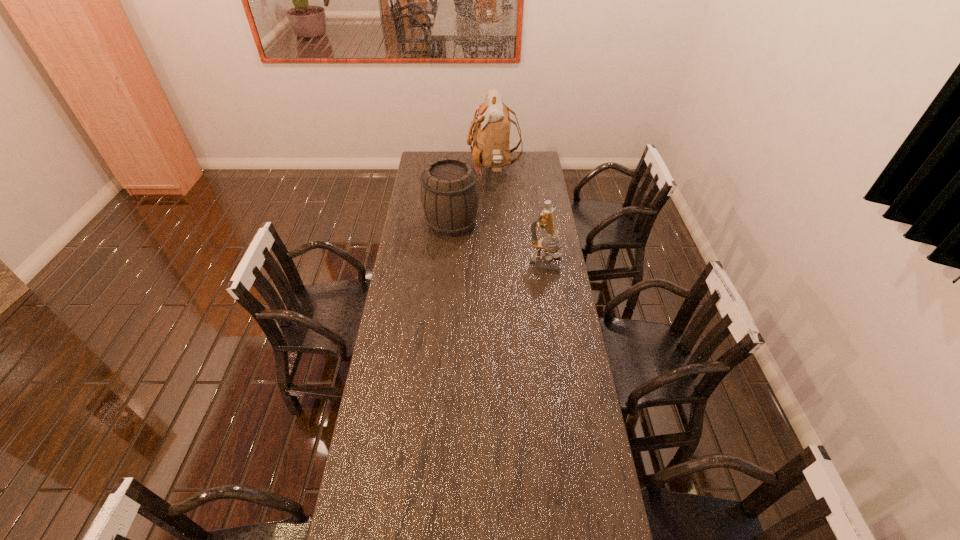
Where is `vacant area between the microscope and the second nearest object`? vacant area between the microscope and the second nearest object is located at coordinates (498, 244).

The image size is (960, 540). I want to click on vacant region between the microscope and the tallest object, so click(x=519, y=217).

Image resolution: width=960 pixels, height=540 pixels. I want to click on vacant point located between the nearest object and the wine bucket, so click(498, 244).

Select which object is the second closest to the second farthest object. Please provide its 2D coordinates. Your answer should be formatted as a tuple, i.e. [(x, y)], where the tuple contains the x and y coordinates of a point satisfying the conditions above.

[(546, 220)]

Choose which object is the second nearest neighbor to the wine bucket. Please provide its 2D coordinates. Your answer should be formatted as a tuple, i.e. [(x, y)], where the tuple contains the x and y coordinates of a point satisfying the conditions above.

[(546, 220)]

You are a GUI agent. You are given a task and a screenshot of the screen. Output one action in this format:
    pyautogui.click(x=<x>, y=<y>)
    Task: Click on the free region that satisfies the following two spatial constraints: 1. on the front-facing side of the nearest object; 2. on the left side of the farthest object
    Image resolution: width=960 pixels, height=540 pixels.
    Given the screenshot: What is the action you would take?
    497,264

Locate an element on the screen. This screenshot has width=960, height=540. vacant area in the image that satisfies the following two spatial constraints: 1. on the back side of the nearest object; 2. on the front-facing side of the backpack is located at coordinates (531, 170).

The height and width of the screenshot is (540, 960). Identify the location of free spot that satisfies the following two spatial constraints: 1. on the back side of the microscope; 2. on the front-facing side of the tallest object. (531, 170).